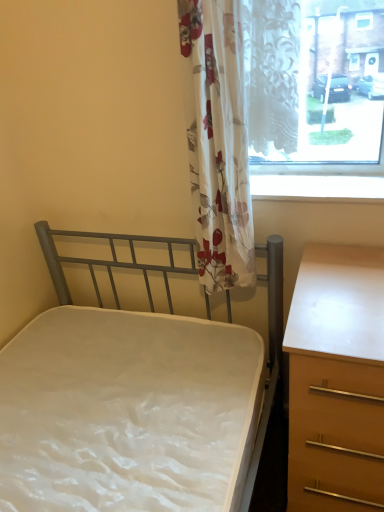
This screenshot has width=384, height=512. I want to click on free space above white glossy window sill at upper center (from a real-world perspective), so click(x=291, y=183).